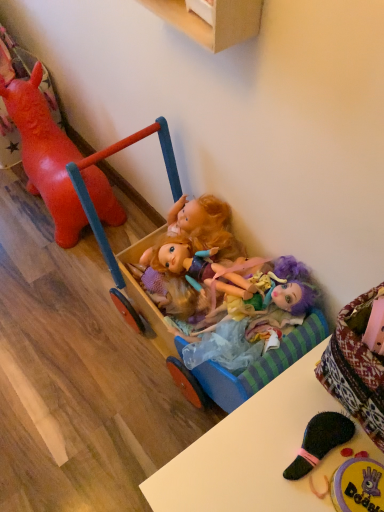
This screenshot has width=384, height=512. Identify the location of free space above white glossy table at lower right (from a real-world perspective). (285, 451).